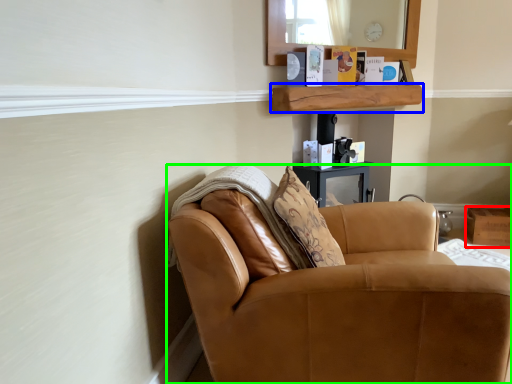
Question: Considering the real-world distances, which object is closest to box (highlighted by a red box)? shelf (highlighted by a blue box) or chair (highlighted by a green box).

Choices:
 (A) shelf
 (B) chair

Answer: (A)